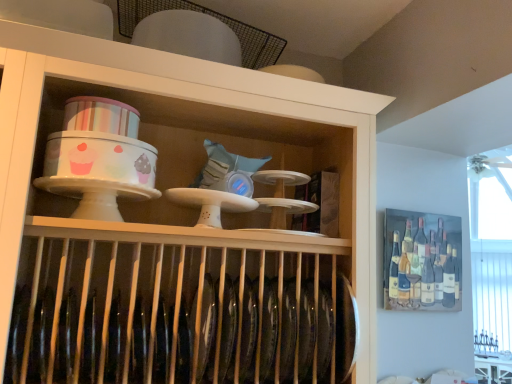
Question: Considering the positions of white glossy cake stand at upper center and white glossy table at lower right in the image, is white glossy cake stand at upper center taller or shorter than white glossy table at lower right?

Choices:
 (A) short
 (B) tall

Answer: (B)

Question: In terms of size, does white glossy cake stand at upper center appear bigger or smaller than white glossy table at lower right?

Choices:
 (A) big
 (B) small

Answer: (A)

Question: Based on their relative distances, which object is farther from the white glossy cake stand at upper center?

Choices:
 (A) painted wooden wine rack at upper right
 (B) white glossy table at lower right

Answer: (B)

Question: Which is nearer to the white glossy table at lower right?

Choices:
 (A) painted wooden wine rack at upper right
 (B) white glossy cake stand at upper center

Answer: (A)